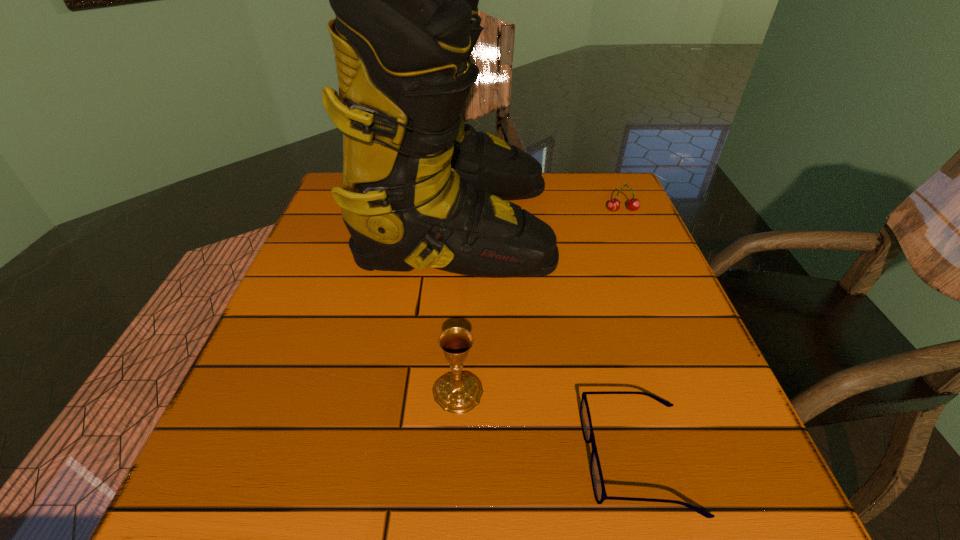
Identify the location of free space between the ski boots and the second shortest object. The image size is (960, 540). (540, 217).

Where is `free area in between the rightmost object and the tallest object`? Image resolution: width=960 pixels, height=540 pixels. free area in between the rightmost object and the tallest object is located at coordinates (540, 217).

Find the location of a particular element. The height and width of the screenshot is (540, 960). unoccupied area between the ski boots and the shortest object is located at coordinates (547, 341).

You are a GUI agent. You are given a task and a screenshot of the screen. Output one action in this format:
    pyautogui.click(x=<x>, y=<y>)
    Task: Click on the empty space between the shortest object and the rightmost object
    
    Given the screenshot: What is the action you would take?
    pyautogui.click(x=631, y=334)

The image size is (960, 540). Find the location of `vacant area between the second tallest object and the rightmost object`. vacant area between the second tallest object and the rightmost object is located at coordinates (540, 301).

Find the location of a particular element. The height and width of the screenshot is (540, 960). vacant region between the chalice and the ski boots is located at coordinates point(458,308).

Identify which object is the closest to the rightmost object. Please provide its 2D coordinates. Your answer should be formatted as a tuple, i.e. [(x, y)], where the tuple contains the x and y coordinates of a point satisfying the conditions above.

[(420, 189)]

At what (x,y) coordinates should I click in order to perform the action: click on the second closest object to the ski boots. Please return your answer as a coordinate pair (x, y). Looking at the image, I should click on (459, 392).

Identify the location of vacant space that satisfies the following two spatial constraints: 1. with stems pointing upwards on the rightmost object; 2. on the front-facing side of the shortest object. The image size is (960, 540). (729, 458).